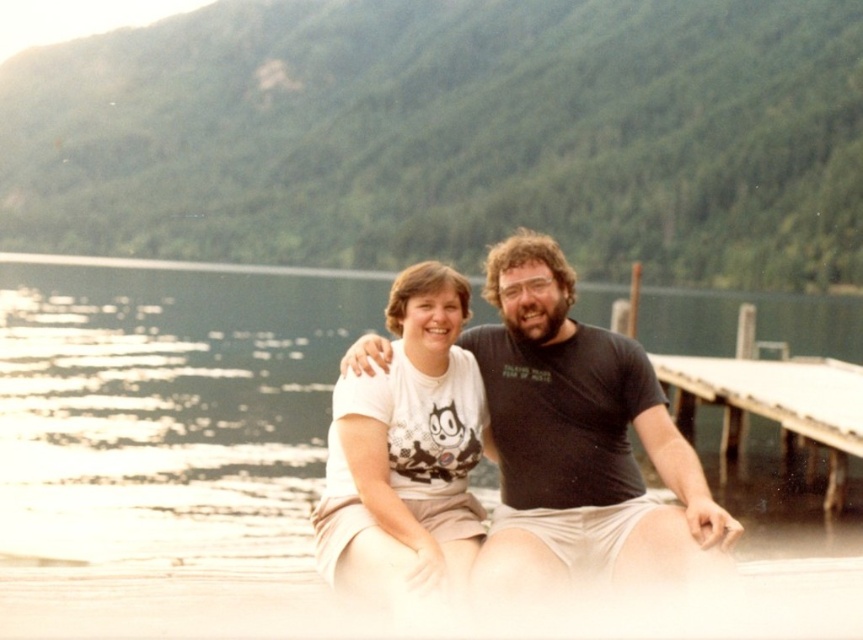
You are a photographer trying to capture the reflection of the green matte water at center in your shot. Given that your camera can only focus on objects within a 0.2 unit radius from the center point, will the reflection be in focus?

The green matte water at center is positioned at point coordinates of (167, 404). Since your camera can only focus within a 0.2 unit radius from the center, the distance between the water and the center point is sqrt of squared differences in x and y coordinates. Calculating sqrt of squared difference between 0.634 and 0.5 in x, and 0.195 and 0.5 in y. The distance is sqrt of 0.134 squared plus 0.305 squared. That equals sqrt of 0.017956 plus 0.093025, totaling sqrt of 0.110981, which is approximately 0.3

Based on the scene described, if someone wants to walk from the white wooden dock at right to the green matte water at center, which direction should they move?

They should move to the left since the green matte water at center is to the left of the white wooden dock at right according to the description.